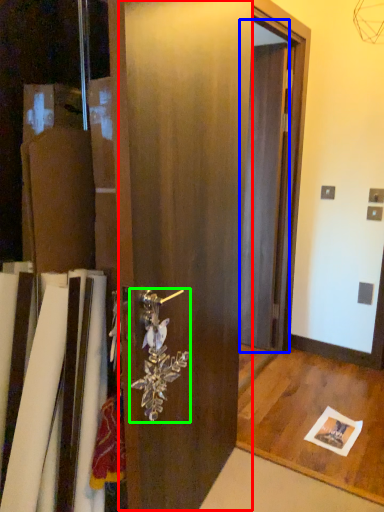
Question: Which object is positioned closest to barn door (highlighted by a red box)? Select from screen door (highlighted by a blue box) and door handle (highlighted by a green box).

Choices:
 (A) screen door
 (B) door handle

Answer: (B)